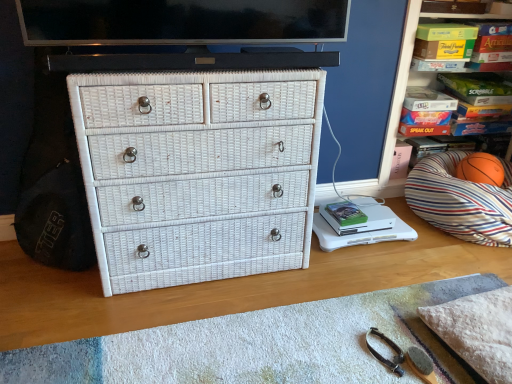
Where is `vacant space situated above white wicker drawer at center (from a real-world perspective)`? Image resolution: width=512 pixels, height=384 pixels. vacant space situated above white wicker drawer at center (from a real-world perspective) is located at coordinates (318, 344).